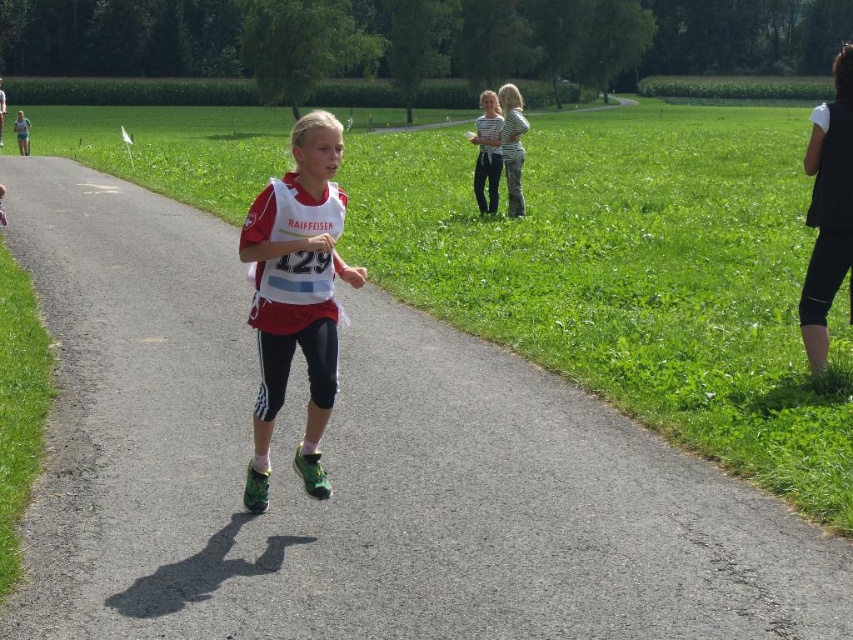
Question: Considering the real-world distances, which object is closest to the striped fabric shirt at upper center?

Choices:
 (A) striped cotton shirt at upper center
 (B) matte red and white bib at center
 (C) black matte vest at right

Answer: (A)

Question: Is matte red and white bib at center above striped fabric shirt at upper center?

Choices:
 (A) yes
 (B) no

Answer: (B)

Question: Does striped cotton shirt at upper center have a smaller size compared to striped fabric shirt at upper center?

Choices:
 (A) no
 (B) yes

Answer: (B)

Question: Does striped cotton shirt at upper center lie in front of striped fabric shirt at upper center?

Choices:
 (A) no
 (B) yes

Answer: (A)

Question: Which is farther from the striped fabric shirt at upper center?

Choices:
 (A) matte red and white bib at center
 (B) striped cotton shirt at upper center
 (C) black matte vest at right

Answer: (A)

Question: Which of the following is the closest to the observer?

Choices:
 (A) (520, 148)
 (B) (833, 161)
 (C) (485, 129)
 (D) (274, 288)

Answer: (D)